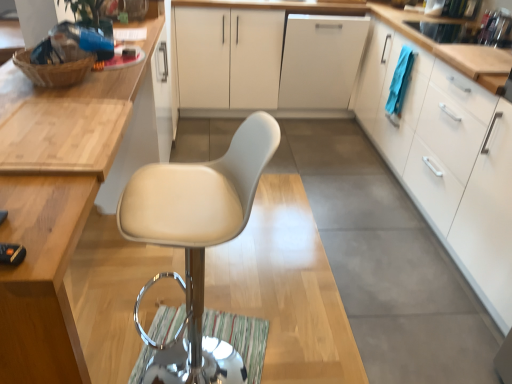
Locate an element on the screen. The image size is (512, 384). free space above matte wood cabinet at upper left, the first cabinetry from the left (from a real-world perspective) is located at coordinates (54, 118).